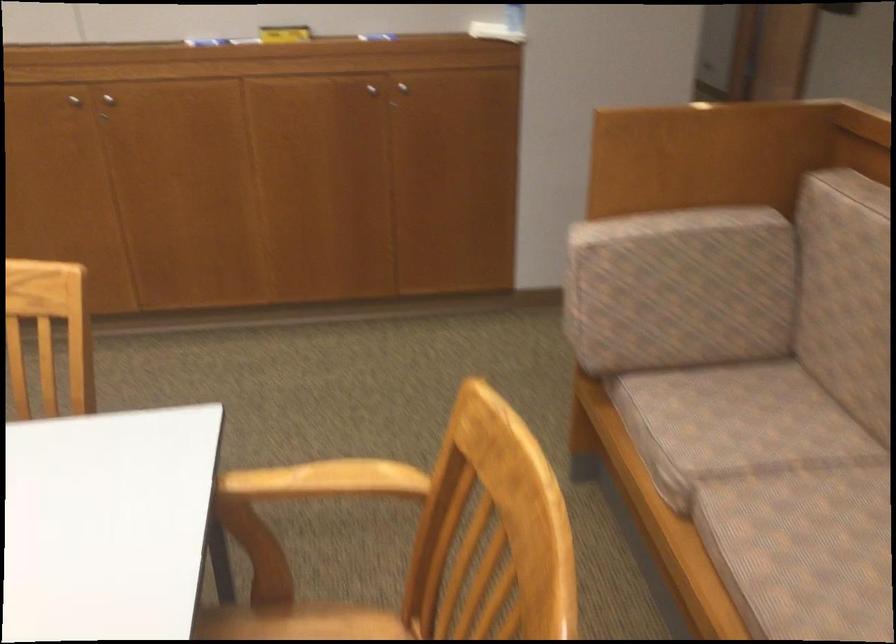
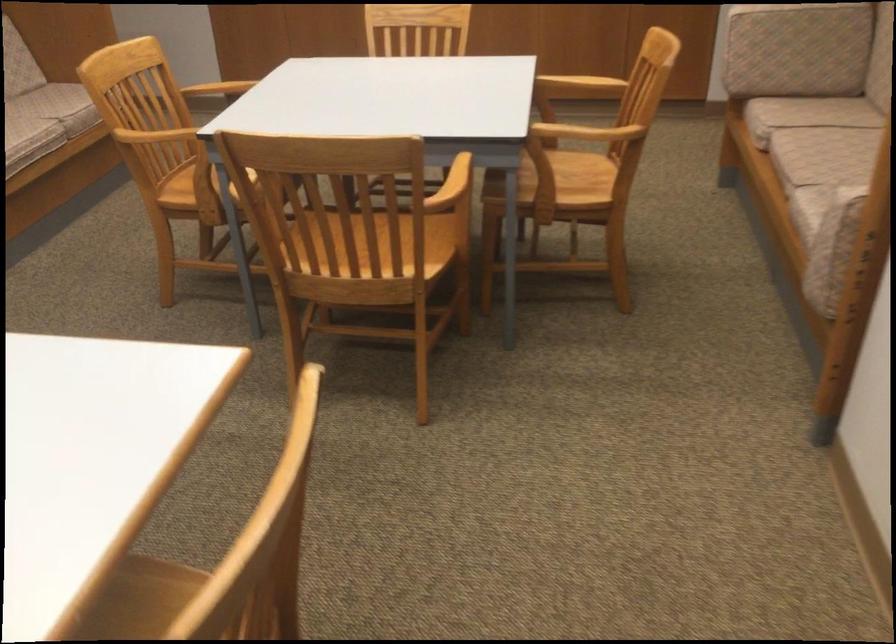
The point at (x=334, y=296) is marked in the first image. Where is the corresponding point in the second image?

(580, 84)